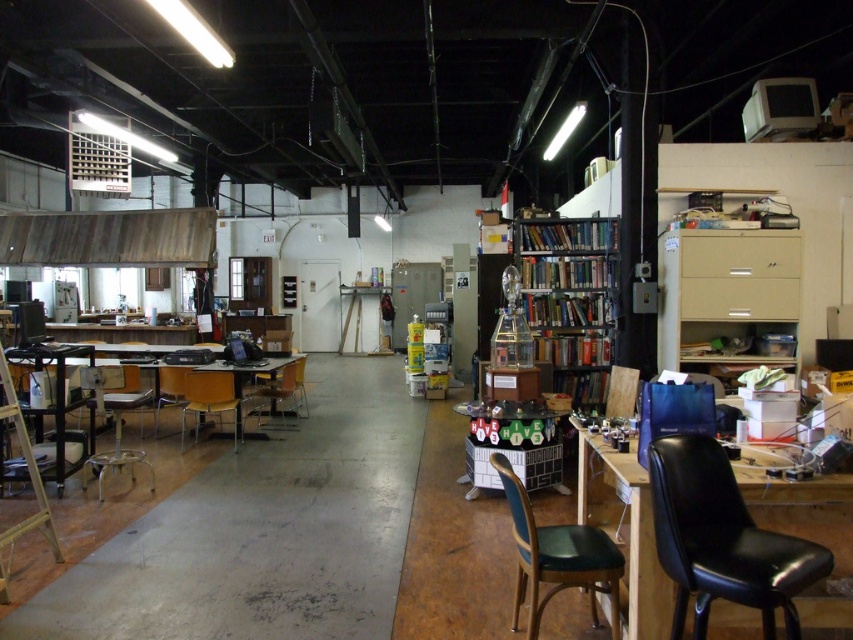
You are standing at the origin point in the center of the workspace. Where is the wooden table at left located in terms of its 2D coordinates?

The wooden table at left is located at the 2D coordinates of point (80, 403).

You are a delivery person who needs to place a package on the floor between the wooden table at left and the wooden chair at center. The package is 30 inches long. Can you fit it horizontally between them?

The distance between the wooden table at left and the wooden chair at center is 35.45 inches. Since the package is 30 inches long, it can be placed horizontally between them as there is enough space.